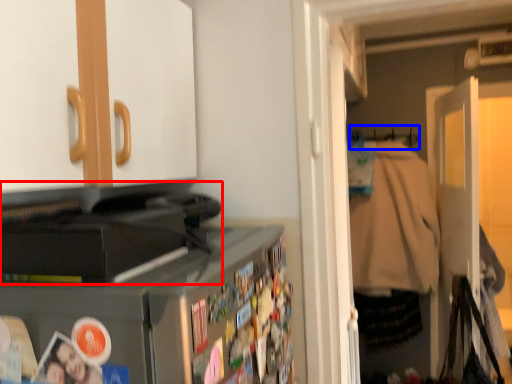
Question: Which object is closer to the camera taking this photo, appliance (highlighted by a red box) or hanger (highlighted by a blue box)?

Choices:
 (A) appliance
 (B) hanger

Answer: (A)